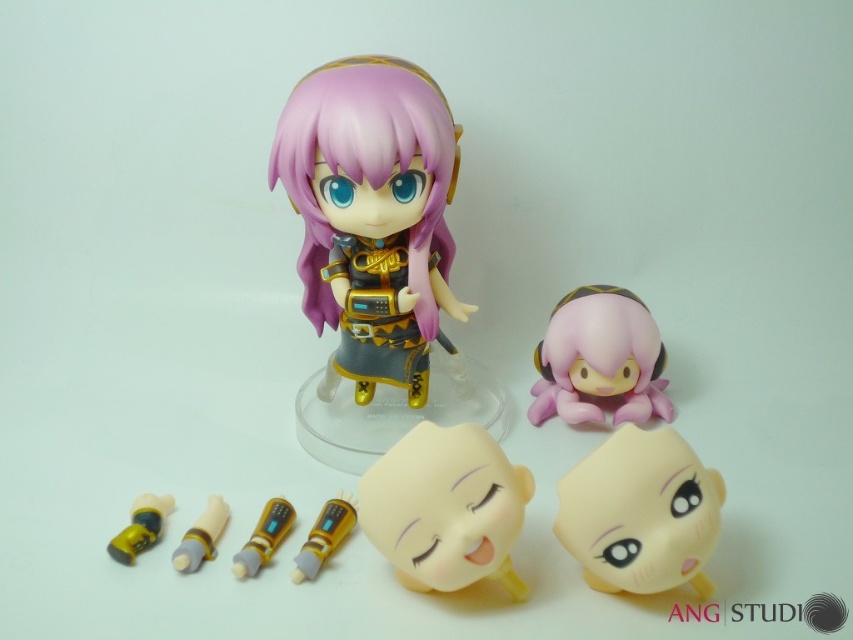
Question: Among these points, which one is farthest from the camera?

Choices:
 (A) (x=635, y=376)
 (B) (x=264, y=515)
 (C) (x=151, y=515)
 (D) (x=351, y=508)

Answer: (A)

Question: Is smooth yellow plushie at center bigger than yellow matte bullet at lower left?

Choices:
 (A) yes
 (B) no

Answer: (A)

Question: Which of the following is the closest to the observer?

Choices:
 (A) pos(216,531)
 (B) pos(310,573)
 (C) pos(422,422)

Answer: (C)

Question: Which object is closer to the camera taking this photo?

Choices:
 (A) smooth yellow plushie at center
 (B) gold metallic tube at center

Answer: (A)

Question: Can you confirm if matte pink toy at center is positioned to the right of gold metallic tube at center?

Choices:
 (A) yes
 (B) no

Answer: (A)

Question: Is smooth yellow plushie at center above matte pink toy at center?

Choices:
 (A) yes
 (B) no

Answer: (B)